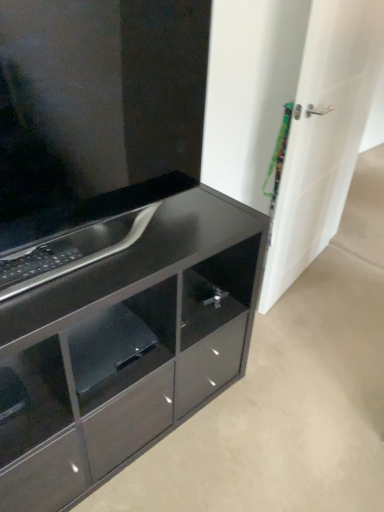
What are the coordinates of `vacant space situated above glossy black shelf at lower center (from a real-world perspective)` in the screenshot? It's located at (102, 332).